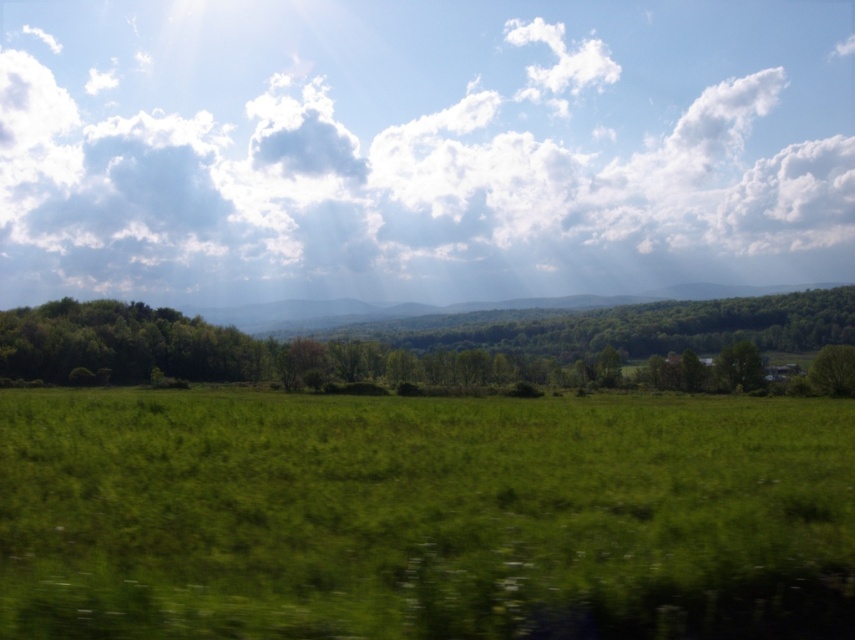
Question: Where is white fluffy cloud at upper center located in relation to green grassy field at center in the image?

Choices:
 (A) right
 (B) left

Answer: (B)

Question: Does white fluffy cloud at upper center come in front of green leafy trees at left?

Choices:
 (A) no
 (B) yes

Answer: (A)

Question: Which of the following is the farthest from the observer?

Choices:
 (A) green leafy tree at right
 (B) green leafy tree at center
 (C) green leafy tree at center-right
 (D) green grassy field at center

Answer: (C)

Question: Which of the following is the farthest from the observer?

Choices:
 (A) (653, 308)
 (B) (747, 372)
 (C) (823, 380)
 (D) (664, 244)

Answer: (D)

Question: Can you confirm if white fluffy cloud at upper center is positioned above green leafy tree at center?

Choices:
 (A) no
 (B) yes

Answer: (B)

Question: Which of these objects is positioned farthest from the green leafy tree at right?

Choices:
 (A) green leafy tree at center-right
 (B) white fluffy cloud at upper center
 (C) green grassy field at center

Answer: (B)